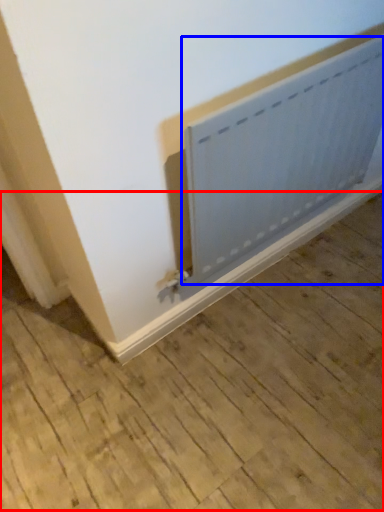
Question: Which object is further to the camera taking this photo, plywood (highlighted by a red box) or radiator (highlighted by a blue box)?

Choices:
 (A) plywood
 (B) radiator

Answer: (B)